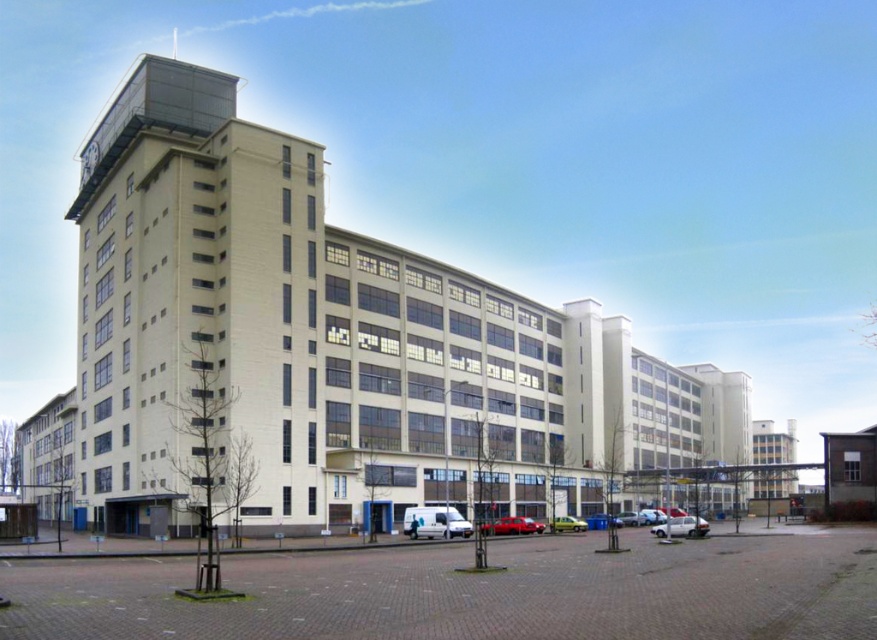
Question: Is shiny red car at center above yellow matte van at center?

Choices:
 (A) yes
 (B) no

Answer: (A)

Question: From the image, what is the correct spatial relationship of silver metallic car at lower center in relation to shiny red car at center?

Choices:
 (A) right
 (B) left

Answer: (A)

Question: Among these points, which one is farthest from the camera?

Choices:
 (A) (550, 531)
 (B) (703, 531)
 (C) (530, 528)

Answer: (A)

Question: Based on their relative distances, which object is farther from the shiny red car at center?

Choices:
 (A) silver metallic car at lower center
 (B) yellow matte van at center

Answer: (A)

Question: Which object is farther from the camera taking this photo?

Choices:
 (A) yellow matte van at center
 (B) silver metallic car at lower center

Answer: (A)

Question: Can you confirm if silver metallic car at lower center is positioned to the left of shiny red car at center?

Choices:
 (A) yes
 (B) no

Answer: (B)